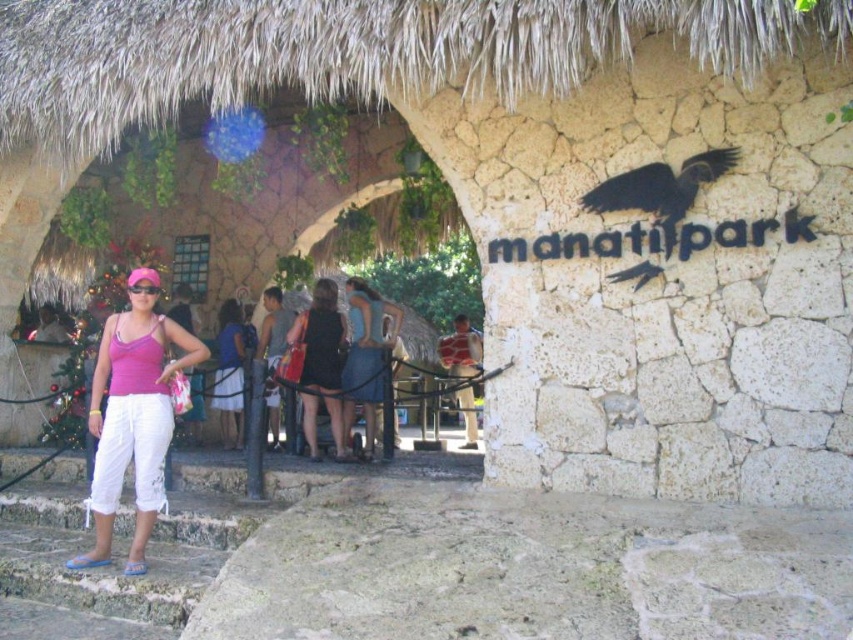
Question: Which of these objects is positioned closest to the black plastic goggles at center?

Choices:
 (A) blue denim skirt at center
 (B) matte pink tank top at left

Answer: (B)

Question: Which point is farther to the camera?

Choices:
 (A) black plastic goggles at center
 (B) blue denim skirt at center
 (C) matte pink tank top at left
 (D) blue denim dress at center

Answer: (D)

Question: Based on their relative distances, which object is farther from the matte pink tank top at left?

Choices:
 (A) blue denim skirt at center
 (B) blue denim dress at center
 (C) matte black dress at center

Answer: (B)

Question: Is the position of matte pink tank top at left more distant than that of blue denim skirt at center?

Choices:
 (A) yes
 (B) no

Answer: (B)

Question: Does matte pink tank top at left have a smaller size compared to matte black dress at center?

Choices:
 (A) no
 (B) yes

Answer: (A)

Question: Is matte black dress at center to the right of black plastic goggles at center from the viewer's perspective?

Choices:
 (A) yes
 (B) no

Answer: (A)